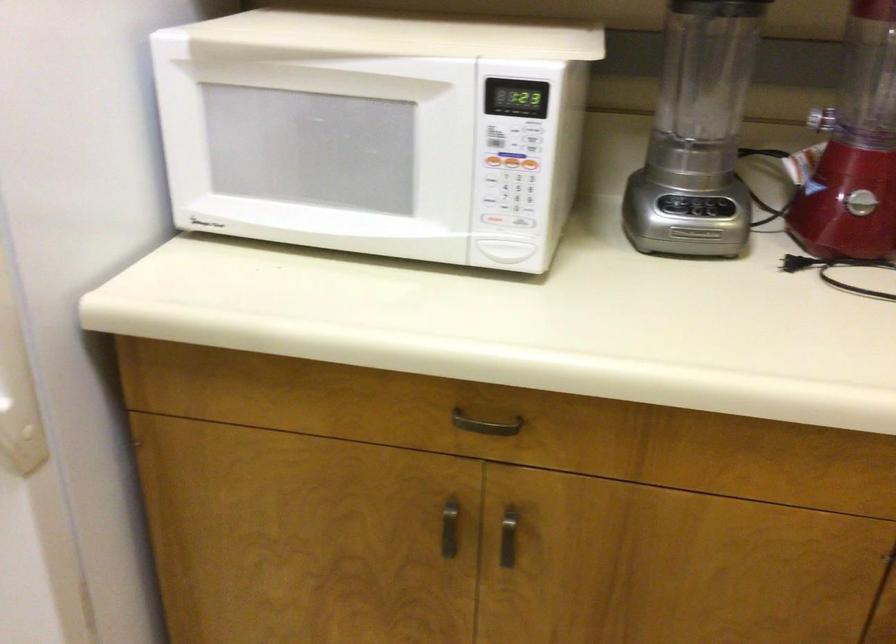
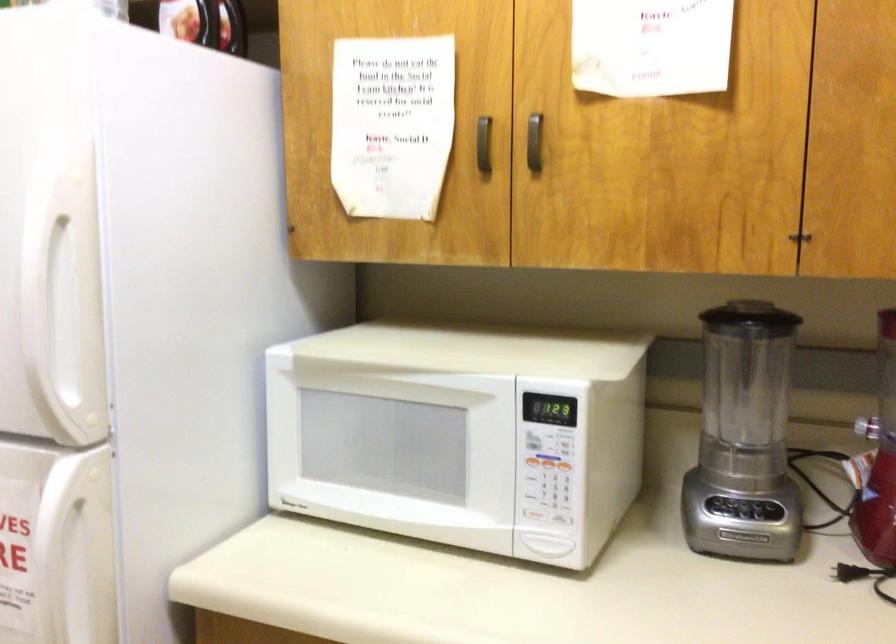
The point at (677, 204) is marked in the first image. Where is the corresponding point in the second image?

(725, 506)